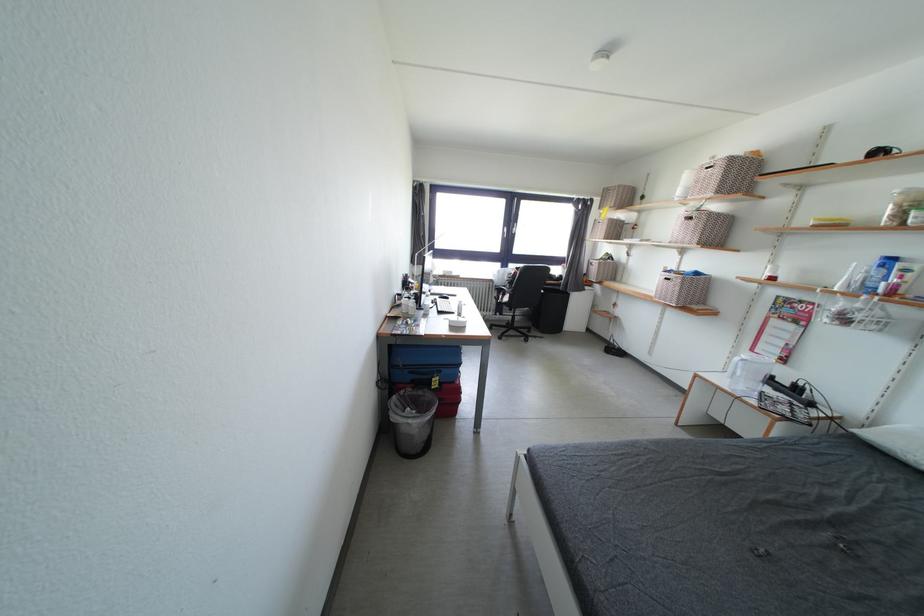
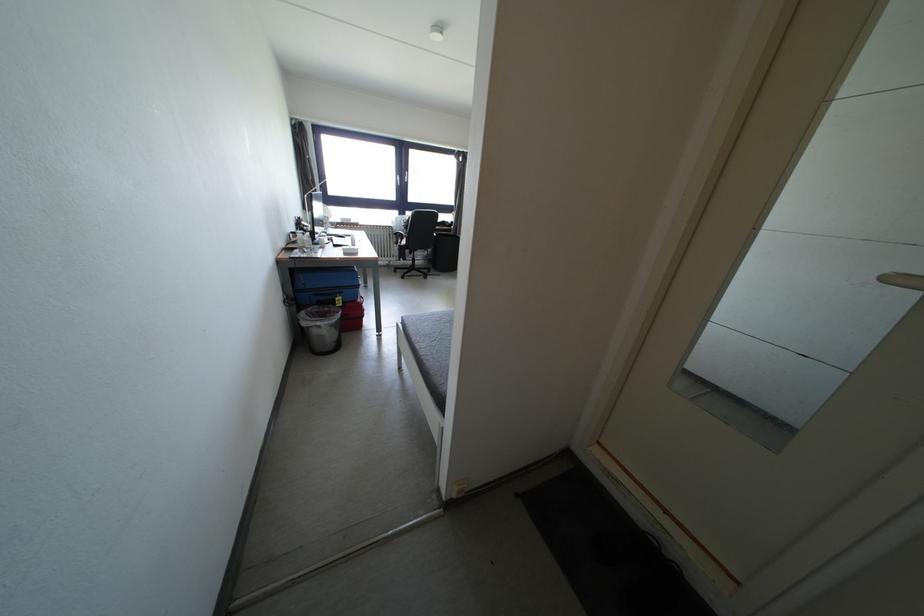
The point at (417, 426) is marked in the first image. Where is the corresponding point in the second image?

(324, 328)